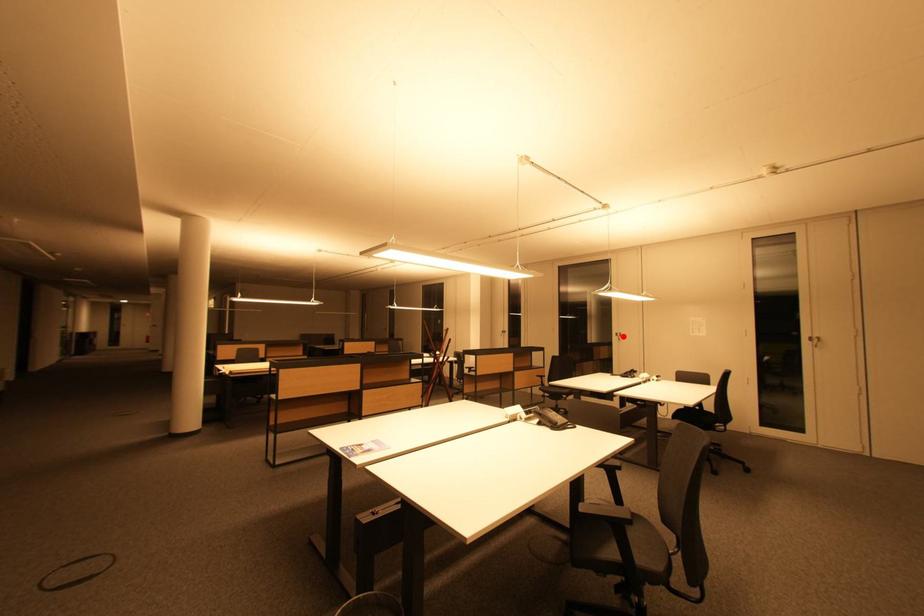
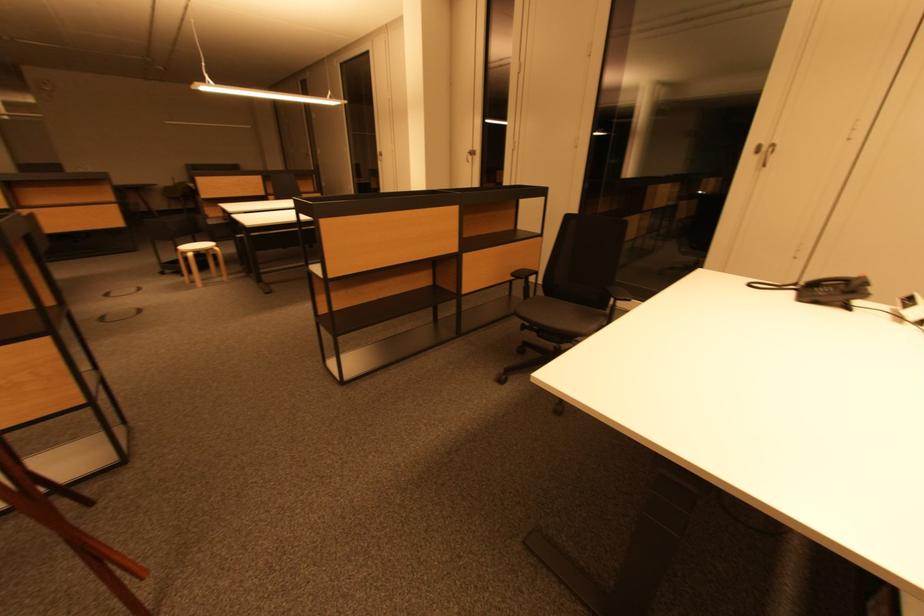
Question: I am providing you with two images of the same scene from different viewpoints. A red point is marked on the first image. At the location where the point appears in image 1, is it still visible in image 2?

Choices:
 (A) Yes
 (B) No

Answer: (A)